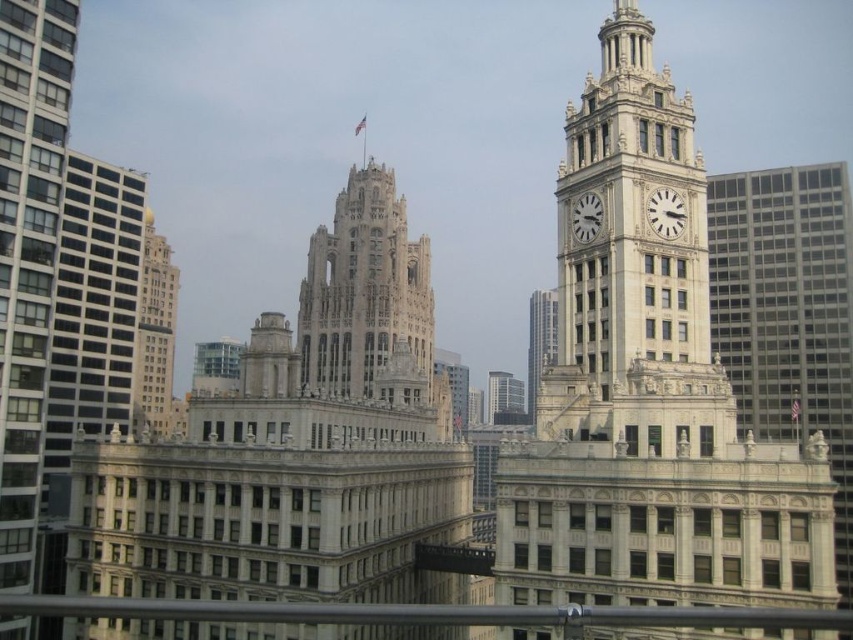
Is point (653, 243) less distant than point (503, 381)?

That is True.

Based on the photo, is white stone clock tower at upper right taller than white stone tower at center?

Yes.

Between point (564, 195) and point (498, 420), which one is positioned behind?

Positioned behind is point (498, 420).

Where is `white stone clock tower at upper right`? white stone clock tower at upper right is located at coordinates (630, 257).

Who is taller, white stone tower at upper center or white marble clock at upper right?

white stone tower at upper center is taller.

Does white stone tower at upper center appear under white marble clock at upper right?

Indeed, white stone tower at upper center is positioned under white marble clock at upper right.

Who is more distant from viewer, (224,445) or (573,228)?

Positioned behind is point (573,228).

At what (x,y) coordinates should I click in order to perform the action: click on white stone tower at upper center. Please return your answer as a coordinate pair (x, y). This screenshot has height=640, width=853. Looking at the image, I should click on (296, 448).

Which is more to the left, light beige stone tower at center or white glass skyscraper at center?

light beige stone tower at center

What do you see at coordinates (364, 291) in the screenshot?
I see `light beige stone tower at center` at bounding box center [364, 291].

Where is `light beige stone tower at center`? light beige stone tower at center is located at coordinates (364, 291).